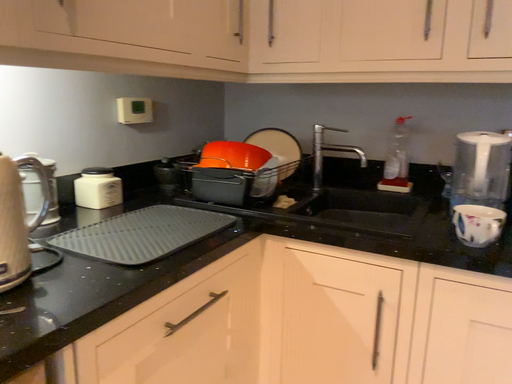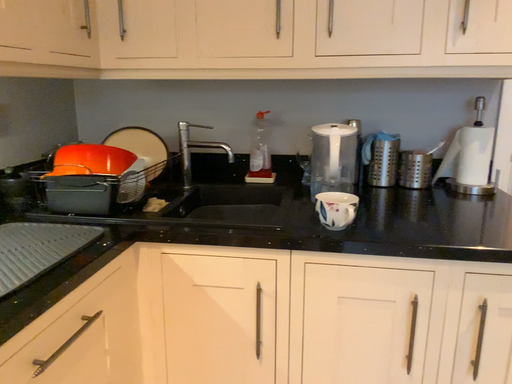
Question: Which way did the camera rotate in the video?

Choices:
 (A) rotated right
 (B) rotated left

Answer: (A)